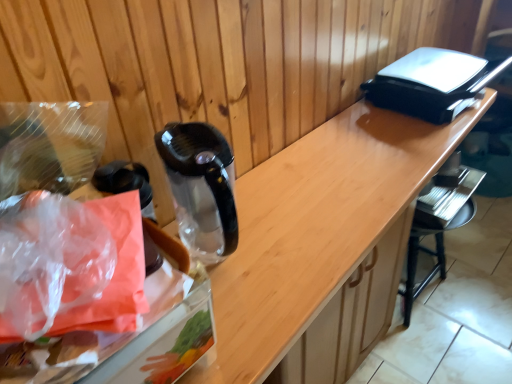
Question: From the image's perspective, is transparent plastic bag at left below translucent plastic bag at left?

Choices:
 (A) no
 (B) yes

Answer: (A)

Question: From a real-world perspective, is transparent plastic bag at left under translucent plastic bag at left?

Choices:
 (A) yes
 (B) no

Answer: (A)

Question: From the image's perspective, is transparent plastic bag at left over translucent plastic bag at left?

Choices:
 (A) no
 (B) yes

Answer: (B)

Question: Could you tell me if transparent plastic bag at left is facing translucent plastic bag at left?

Choices:
 (A) no
 (B) yes

Answer: (A)

Question: Does transparent plastic bag at left lie in front of translucent plastic bag at left?

Choices:
 (A) no
 (B) yes

Answer: (A)

Question: Is the surface of transparent plastic bag at left in direct contact with translucent plastic bag at left?

Choices:
 (A) no
 (B) yes

Answer: (B)

Question: Is wooden counter at center outside of black plastic bar stool at lower right?

Choices:
 (A) yes
 (B) no

Answer: (A)

Question: Does wooden counter at center have a larger size compared to black plastic bar stool at lower right?

Choices:
 (A) no
 (B) yes

Answer: (B)

Question: Is the position of wooden counter at center less distant than that of black plastic bar stool at lower right?

Choices:
 (A) no
 (B) yes

Answer: (B)

Question: Is wooden counter at center further to the viewer compared to black plastic bar stool at lower right?

Choices:
 (A) yes
 (B) no

Answer: (B)

Question: Is wooden counter at center taller than black plastic bar stool at lower right?

Choices:
 (A) no
 (B) yes

Answer: (B)

Question: Is wooden counter at center to the left of black plastic bar stool at lower right from the viewer's perspective?

Choices:
 (A) no
 (B) yes

Answer: (B)

Question: Is black plastic bar stool at lower right to the left of transparent plastic bag at left from the viewer's perspective?

Choices:
 (A) no
 (B) yes

Answer: (A)